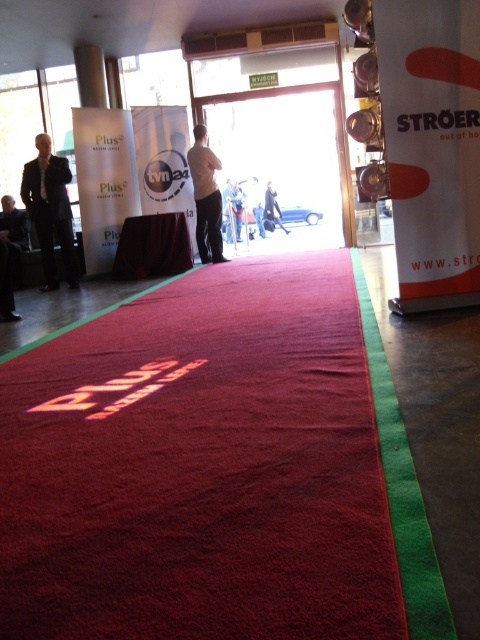
You are a photographer standing at the end of the red carpet. You need to capture a photo of both the light beige fabric pants at center and the dark blue suit at center in the same frame. Given that your camera has a maximum focus range of 15 feet, will you be able to capture both subjects clearly in one shot?

The distance between the light beige fabric pants at center and the dark blue suit at center is 18.40 feet, which exceeds the camera maximum focus range of 15 feet. Therefore, you cannot capture both subjects clearly in one shot.